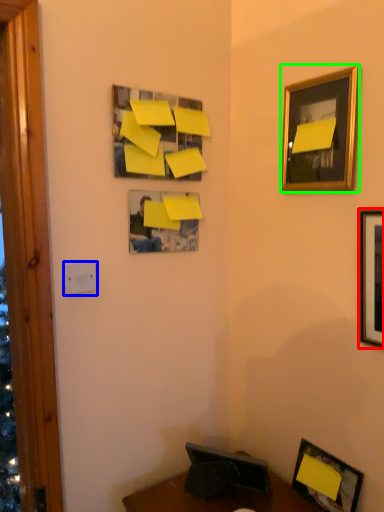
Question: Which object is the farthest from picture frame (highlighted by a red box)? Choose among these: light switch (highlighted by a blue box) or picture frame (highlighted by a green box).

Choices:
 (A) light switch
 (B) picture frame

Answer: (A)